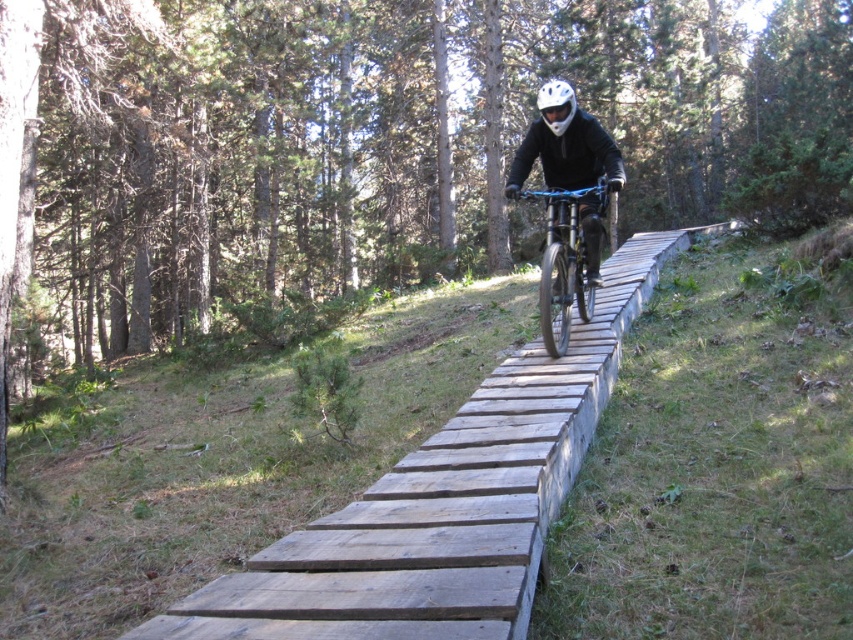
Is shiny black bike at center below white matte helmet at center?

Yes.

What do you see at coordinates (566, 260) in the screenshot?
I see `shiny black bike at center` at bounding box center [566, 260].

Find the location of a particular element. shiny black bike at center is located at coordinates (566, 260).

Which is below, matte black helmet at center or shiny black bike at center?

shiny black bike at center is below.

Who is taller, matte black helmet at center or shiny black bike at center?

shiny black bike at center is taller.

Between point (582, 172) and point (598, 212), which one is positioned in front?

Point (598, 212) is more forward.

Find the location of `matte black helmet at center`. matte black helmet at center is located at coordinates (566, 145).

Does point (572, 154) lie behind point (572, 97)?

Yes.

Can you confirm if matte black helmet at center is wider than white matte helmet at center?

No, matte black helmet at center is not wider than white matte helmet at center.

Between point (585, 179) and point (555, 122), which one is positioned behind?

The point (585, 179) is more distant.

Where is `matte black helmet at center`? The image size is (853, 640). matte black helmet at center is located at coordinates (566, 145).